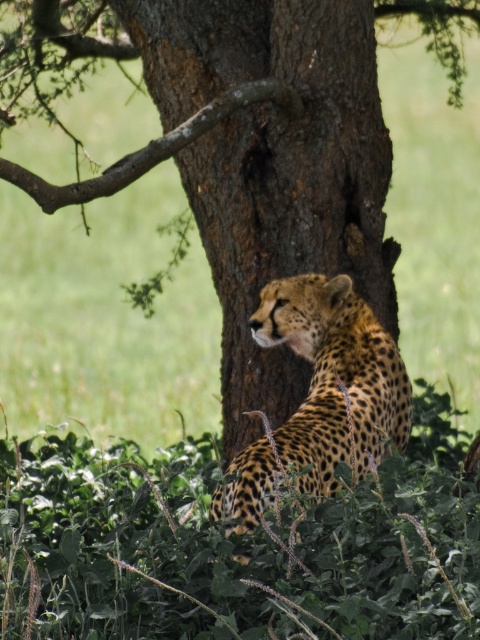
You are a photographer trying to capture the cheetah behind the tree trunk. You notice two points marked in the image at coordinates point [304,252] and point [312,308]. Which point is closer to your camera lens?

Point [304,252] is further to the camera than point [312,308], so the point closer to the camera lens is point [312,308].

You are a wildlife photographer trying to capture a clear shot of the spotted fur cheetah at center. However, the brown rough tree trunk at center is blocking part of the view. Based on their sizes, can you determine if the cheetah is mostly visible or mostly hidden behind the tree trunk?

The brown rough tree trunk at center is taller than the spotted fur cheetah at center, so the cheetah is mostly hidden behind the tree trunk.